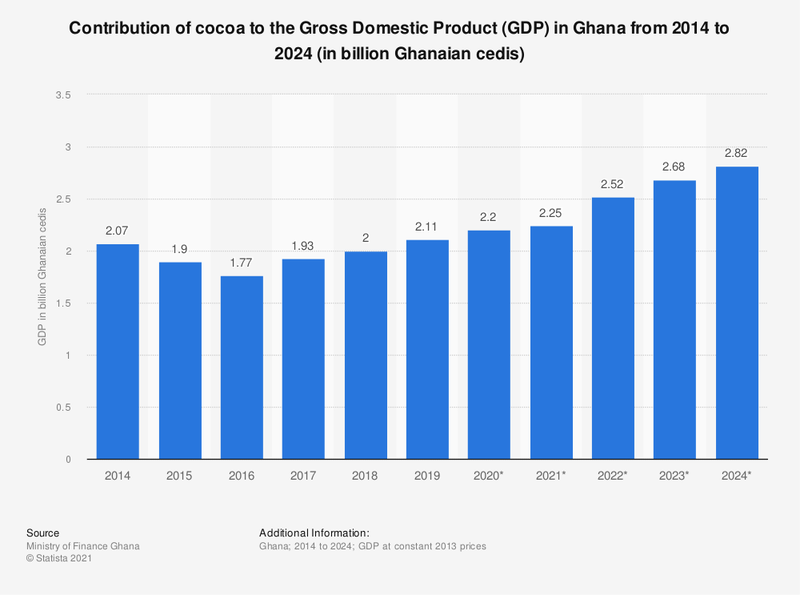
Where is `brackets`? This screenshot has height=595, width=800. brackets is located at coordinates (504, 33), (542, 33).